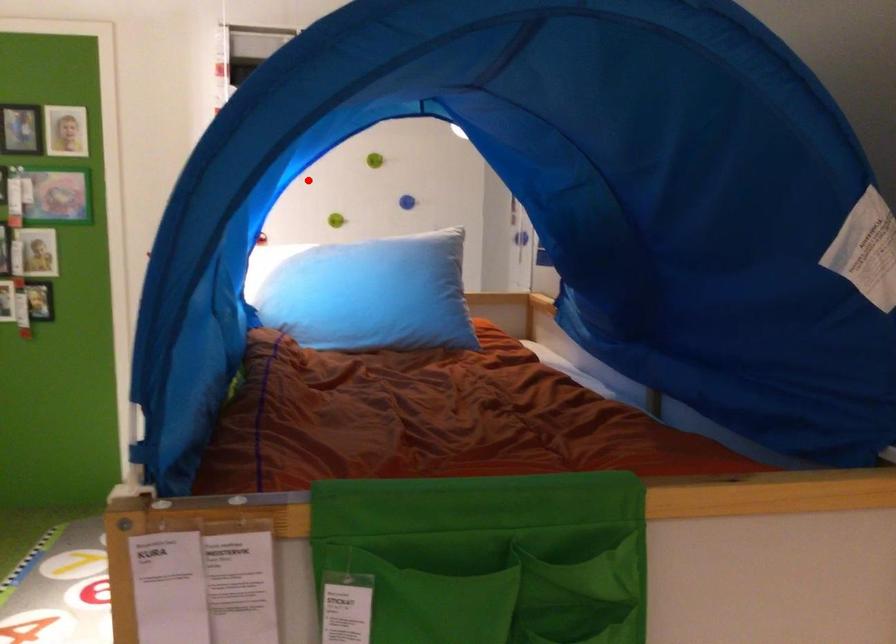
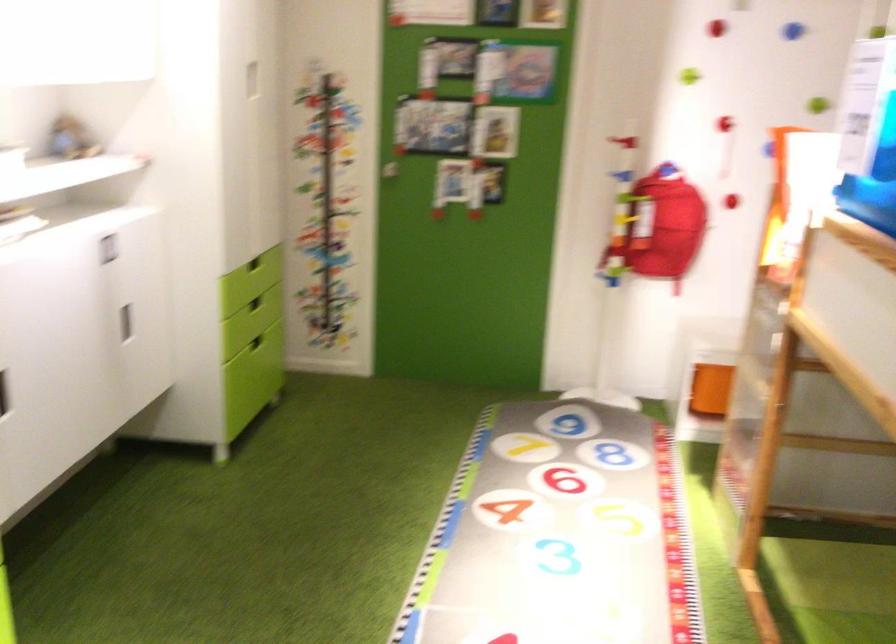
Question: I am providing you with two images of the same scene from different viewpoints. Image1 has a red point marked. In image2, the corresponding 3D location appears at what relative position? Reply with the corresponding letter.

Choices:
 (A) Closer
 (B) Farther

Answer: (A)